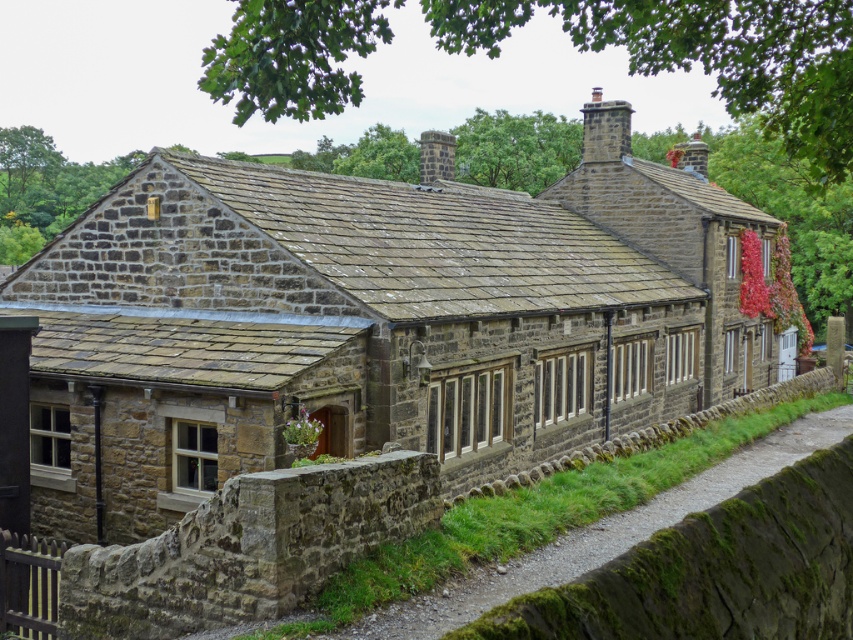
You are standing at the entrance of the rustic stone cottage at center and want to walk to the mossy stone path at lower center. Which direction should you move relative to the cottage?

You should move to the left relative to the rustic stone cottage at center because the mossy stone path at lower center is located to the left of the cottage.

You are standing at the entrance of the rustic stone cottage at center. If you walk straight ahead, will you exit the property through the front gate or remain within the cottage grounds?

The rustic stone cottage at center is located at point (376, 321), which is centrally positioned. Walking straight ahead from the entrance would likely keep you within the cottage grounds as the front gate is not mentioned in the scene description. However, without specific gate location details, this is an assumption based on typical cottage layouts.

You are standing in front of the traditional stone house and want to determine which of the two points, point (387,369) or point (558,554), is closer to you. Which point is nearer?

Point (387,369) is closer to you because it is further to the viewer than point (558,554).